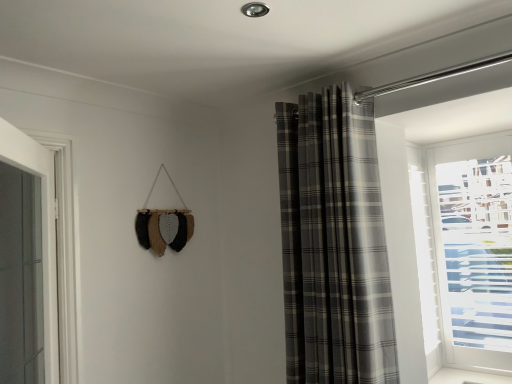
Question: Is white glossy door at left not within plaid fabric curtain at upper right?

Choices:
 (A) yes
 (B) no

Answer: (A)

Question: Does white glossy door at left have a greater height compared to plaid fabric curtain at upper right?

Choices:
 (A) yes
 (B) no

Answer: (B)

Question: Does white glossy door at left have a greater width compared to plaid fabric curtain at upper right?

Choices:
 (A) no
 (B) yes

Answer: (A)

Question: Does white glossy door at left appear on the right side of plaid fabric curtain at upper right?

Choices:
 (A) yes
 (B) no

Answer: (B)

Question: Considering the relative sizes of white glossy door at left and plaid fabric curtain at upper right in the image provided, is white glossy door at left bigger than plaid fabric curtain at upper right?

Choices:
 (A) no
 (B) yes

Answer: (A)

Question: Are white glossy door at left and plaid fabric curtain at upper right far apart?

Choices:
 (A) yes
 (B) no

Answer: (A)

Question: Does plaid fabric curtain at upper right lie in front of white glossy door at left?

Choices:
 (A) no
 (B) yes

Answer: (A)

Question: Can you confirm if plaid fabric curtain at upper right is thinner than white glossy door at left?

Choices:
 (A) yes
 (B) no

Answer: (B)

Question: Is plaid fabric curtain at upper right beside white glossy door at left?

Choices:
 (A) no
 (B) yes

Answer: (A)

Question: From the image's perspective, does plaid fabric curtain at upper right appear higher than white glossy door at left?

Choices:
 (A) yes
 (B) no

Answer: (A)

Question: Considering the relative sizes of plaid fabric curtain at upper right and white glossy door at left in the image provided, is plaid fabric curtain at upper right wider than white glossy door at left?

Choices:
 (A) no
 (B) yes

Answer: (B)

Question: Does plaid fabric curtain at upper right have a greater height compared to white glossy door at left?

Choices:
 (A) yes
 (B) no

Answer: (A)

Question: Is plaid fabric curtain at upper right bigger or smaller than white glossy door at left?

Choices:
 (A) small
 (B) big

Answer: (B)